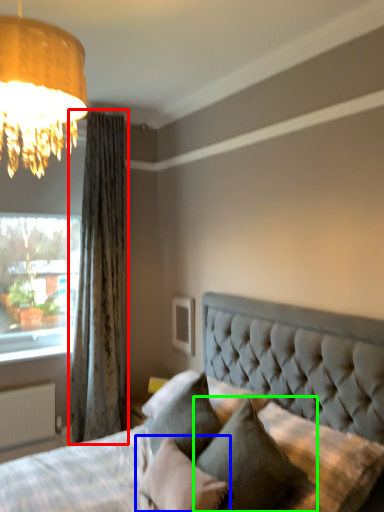
Question: Based on their relative distances, which object is nearer to curtain (highlighted by a red box)? Choose from pillow (highlighted by a blue box) and pillow (highlighted by a green box).

Choices:
 (A) pillow
 (B) pillow

Answer: (A)